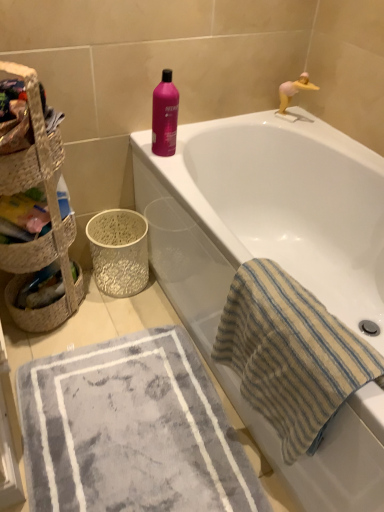
Question: Is gray plush bath mat at lower left touching woven straw basket at left, arranged as the 1th basket when ordered from the bottom?

Choices:
 (A) yes
 (B) no

Answer: (B)

Question: Considering the relative positions of gray plush bath mat at lower left and woven straw basket at left, the second basket viewed from the top, in the image provided, is gray plush bath mat at lower left in front of woven straw basket at left, the second basket viewed from the top,?

Choices:
 (A) no
 (B) yes

Answer: (A)

Question: From the image's perspective, is gray plush bath mat at lower left located above woven straw basket at left, arranged as the 1th basket when ordered from the bottom?

Choices:
 (A) yes
 (B) no

Answer: (B)

Question: Is gray plush bath mat at lower left taller than woven straw basket at left, the second basket viewed from the top?

Choices:
 (A) no
 (B) yes

Answer: (A)

Question: From a real-world perspective, is gray plush bath mat at lower left located higher than woven straw basket at left, arranged as the 1th basket when ordered from the bottom?

Choices:
 (A) no
 (B) yes

Answer: (A)

Question: From a real-world perspective, is gray plush bath mat at lower left physically below woven straw basket at left, arranged as the 1th basket when ordered from the bottom?

Choices:
 (A) no
 (B) yes

Answer: (B)

Question: Is pink glossy bottle at upper center taller than pink plastic toy at upper right?

Choices:
 (A) no
 (B) yes

Answer: (B)

Question: Considering the relative sizes of pink glossy bottle at upper center and pink plastic toy at upper right in the image provided, is pink glossy bottle at upper center shorter than pink plastic toy at upper right?

Choices:
 (A) no
 (B) yes

Answer: (A)

Question: Is pink glossy bottle at upper center closer to the viewer compared to pink plastic toy at upper right?

Choices:
 (A) yes
 (B) no

Answer: (A)

Question: Considering the relative sizes of pink glossy bottle at upper center and pink plastic toy at upper right in the image provided, is pink glossy bottle at upper center smaller than pink plastic toy at upper right?

Choices:
 (A) no
 (B) yes

Answer: (A)

Question: From the image's perspective, is pink glossy bottle at upper center above pink plastic toy at upper right?

Choices:
 (A) yes
 (B) no

Answer: (B)

Question: Is pink glossy bottle at upper center thinner than pink plastic toy at upper right?

Choices:
 (A) no
 (B) yes

Answer: (A)

Question: From a real-world perspective, is white textured basket at lower left, which appears as the first basket container when ordered from the bottom, beneath gray plush bath mat at lower left?

Choices:
 (A) yes
 (B) no

Answer: (B)